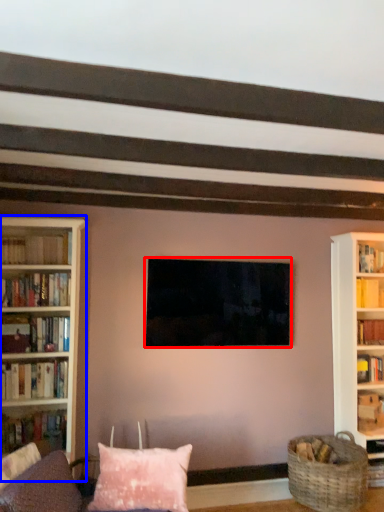
Question: Which object is further to the camera taking this photo, television (highlighted by a red box) or bookcase (highlighted by a blue box)?

Choices:
 (A) television
 (B) bookcase

Answer: (A)